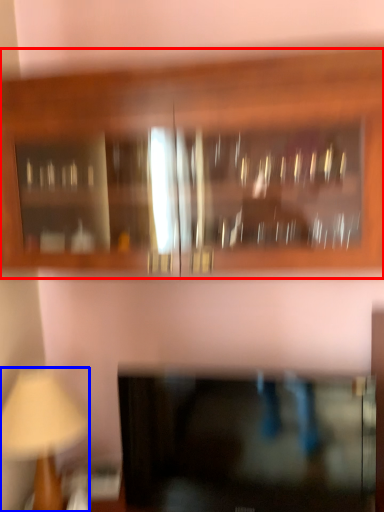
Question: Which object is closer to the camera taking this photo, cabinetry (highlighted by a red box) or table lamp (highlighted by a blue box)?

Choices:
 (A) cabinetry
 (B) table lamp

Answer: (A)